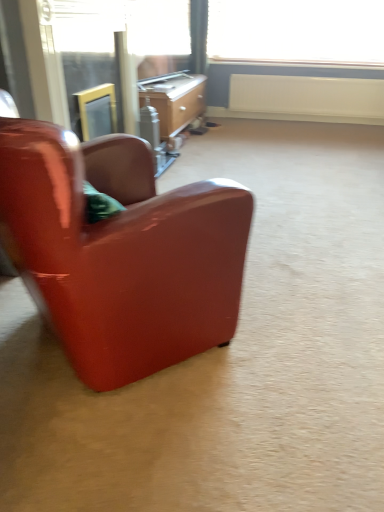
Question: Is white matte radiator at upper center taller or shorter than glossy leather chair at left?

Choices:
 (A) short
 (B) tall

Answer: (A)

Question: From the image's perspective, is white matte radiator at upper center positioned above or below glossy leather chair at left?

Choices:
 (A) below
 (B) above

Answer: (B)

Question: Which object is positioned farthest from the clear glass screen door at upper left, which is counted as the 1th screen door, starting from the right?

Choices:
 (A) white matte radiator at upper center
 (B) wooden desk at center
 (C) glossy leather chair at left
 (D) matte glass screen door at upper left, which is counted as the 1th screen door, starting from the left
 (E) transparent plastic window screen at upper center

Answer: (E)

Question: Estimate the real-world distances between objects in this image. Which object is closer to the matte glass screen door at upper left, which is counted as the 1th screen door, starting from the left?

Choices:
 (A) transparent plastic window screen at upper center
 (B) glossy leather chair at left
 (C) wooden desk at center
 (D) white matte radiator at upper center
 (E) clear glass screen door at upper left, positioned as the 2th screen door in left-to-right order

Answer: (E)